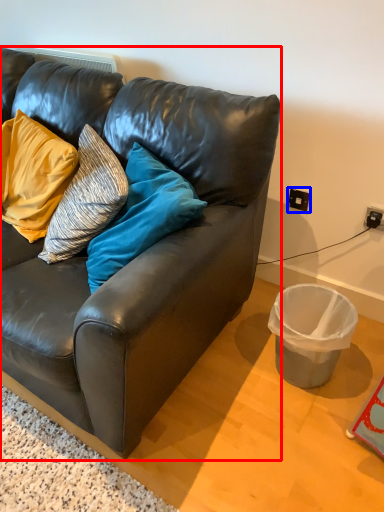
Question: Which of the following is the farthest to the observer, studio couch (highlighted by a red box) or power outlet (highlighted by a blue box)?

Choices:
 (A) studio couch
 (B) power outlet

Answer: (B)